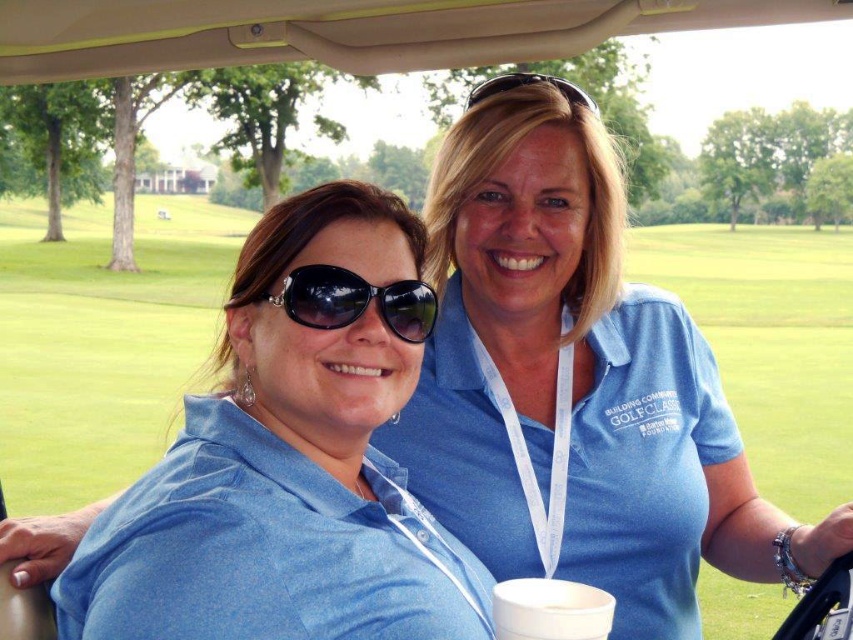
Looking at this image, you are standing in front of the golf cart and want to know which of the two points, point (323, 532) or point (352, 301), is nearer to you. Can you determine this?

Point (323, 532) is closer to the camera than point (352, 301), so it is nearer to you.

You are a photographer taking a picture of the blue cotton shirt at center and the black reflective sunglasses at center. Which object is wider in the image?

The blue cotton shirt at center is wider than the black reflective sunglasses at center.